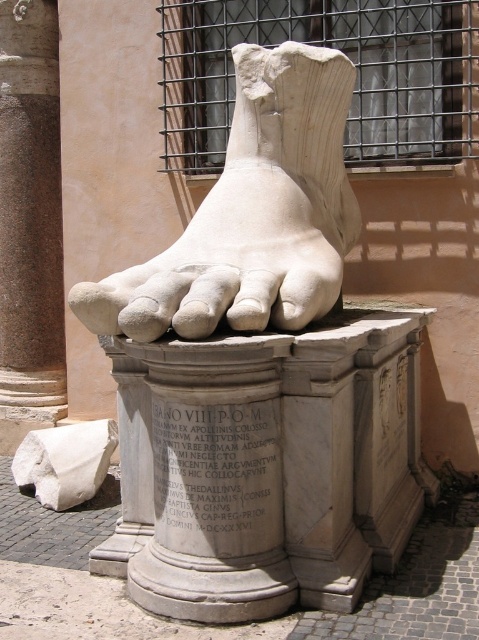
Question: Which of these objects is positioned farthest from the white marble block at lower left?

Choices:
 (A) granite column at left
 (B) white marble foot at center

Answer: (B)

Question: Is granite column at left closer to camera compared to white marble block at lower left?

Choices:
 (A) yes
 (B) no

Answer: (B)

Question: Is granite column at left bigger than white marble block at lower left?

Choices:
 (A) no
 (B) yes

Answer: (B)

Question: Which point is farther to the camera?

Choices:
 (A) (22, 132)
 (B) (18, 449)
 (C) (339, 280)

Answer: (A)

Question: Which point appears farthest from the camera in this image?

Choices:
 (A) (83, 497)
 (B) (271, 108)

Answer: (A)

Question: Is white marble foot at center to the right of white marble block at lower left from the viewer's perspective?

Choices:
 (A) no
 (B) yes

Answer: (B)